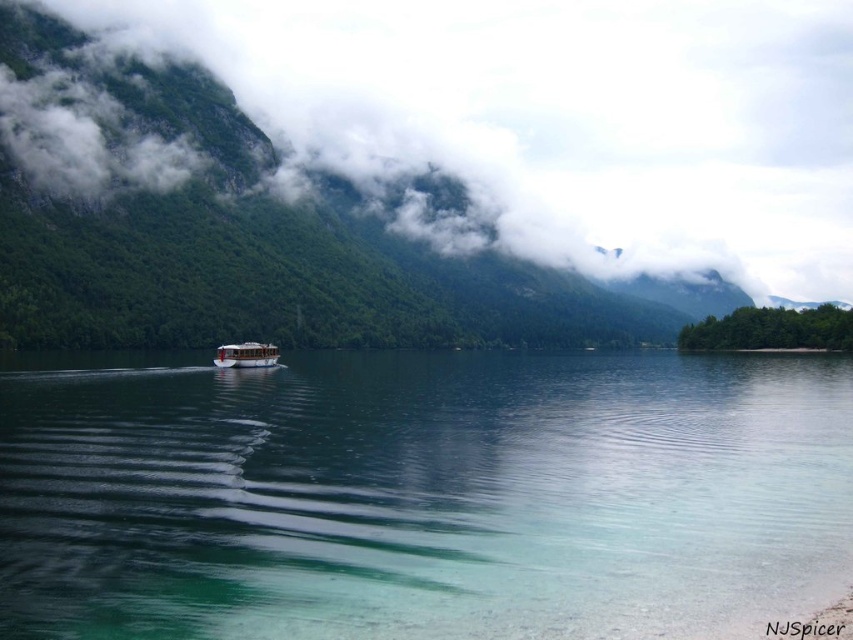
You are standing on the lakeshore and see the clear water at center and the white wooden boat at center. Which object is closer to the water surface?

The white wooden boat at center is closer to the water surface since the clear water at center is located below it.

Looking at the serene lake scene with clear water at center and white fluffy cloud at upper center, which object is positioned to the right side?

The white fluffy cloud at upper center is positioned to the right of the clear water at center.

You are standing on the lakeshore and looking out towards the mountains. You see the clear water at center and the white fluffy cloud at upper center. Which object is closer to you?

The clear water at center is closer to you because it is in front of the white fluffy cloud at upper center.